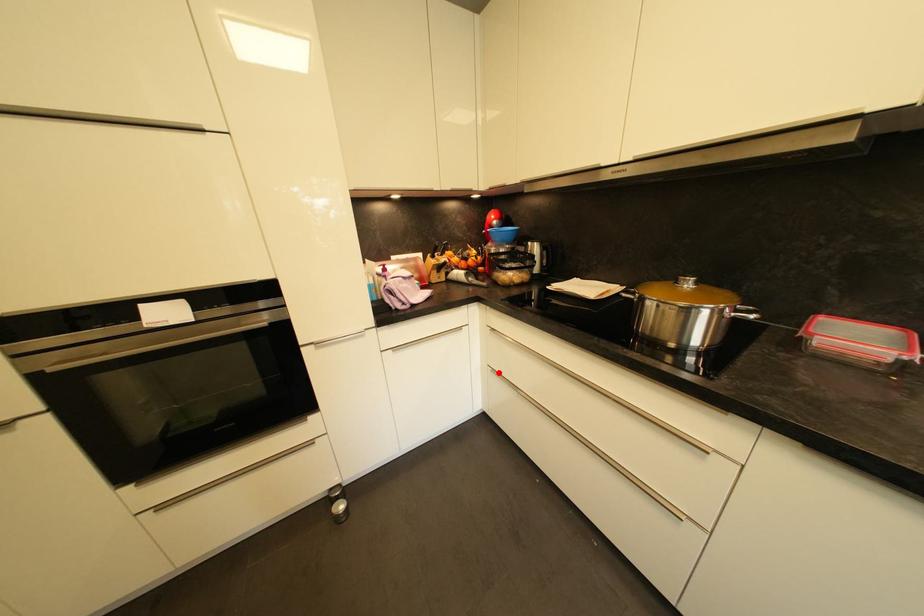
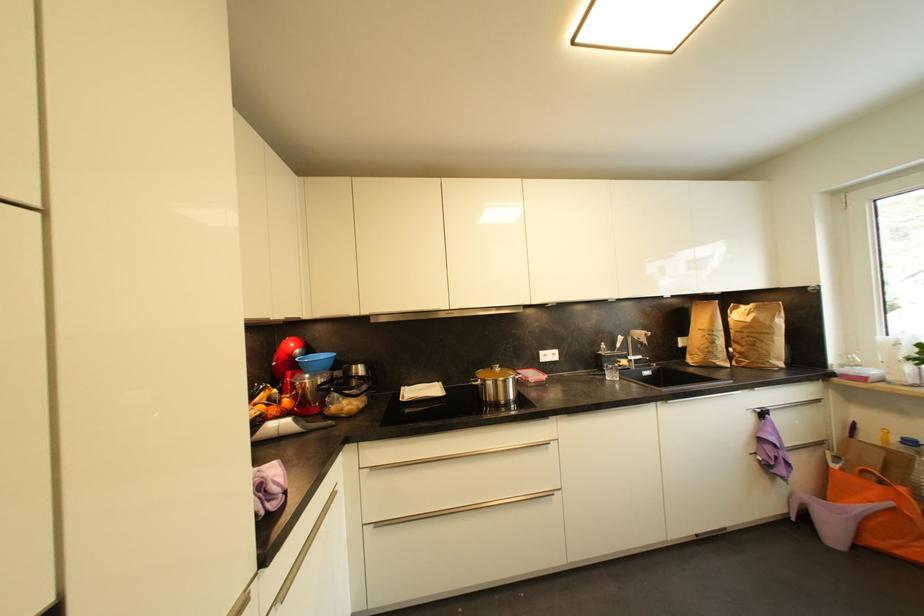
Find the pixel in the second image that matches the highlighted location in the first image.

(382, 527)